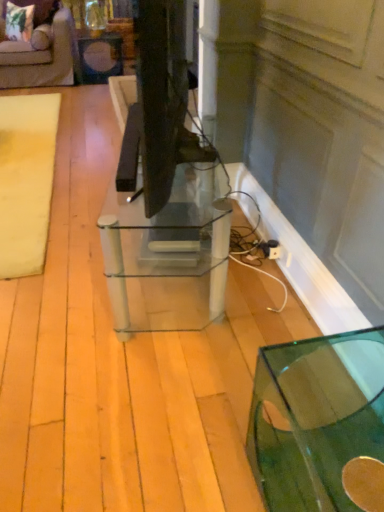
Question: Is beige fabric mat at left to the right of matte black side table at upper left from the viewer's perspective?

Choices:
 (A) yes
 (B) no

Answer: (B)

Question: Is beige fabric mat at left located outside matte black side table at upper left?

Choices:
 (A) no
 (B) yes

Answer: (B)

Question: Could you tell me if beige fabric mat at left is facing matte black side table at upper left?

Choices:
 (A) no
 (B) yes

Answer: (A)

Question: Is beige fabric mat at left bigger than matte black side table at upper left?

Choices:
 (A) yes
 (B) no

Answer: (B)

Question: Can you confirm if beige fabric mat at left is shorter than matte black side table at upper left?

Choices:
 (A) yes
 (B) no

Answer: (A)

Question: Is point (137, 180) positioned closer to the camera than point (279, 484)?

Choices:
 (A) closer
 (B) farther

Answer: (B)

Question: From a real-world perspective, relative to transparent glass table at lower right, arranged as the first table when viewed from the right, is clear glass table at center, marked as the second table in a right-to-left arrangement, vertically above or below?

Choices:
 (A) below
 (B) above

Answer: (B)

Question: In the image, is clear glass table at center, arranged as the second table when viewed from the front, positioned in front of or behind transparent glass table at lower right, the 2th table positioned from the top?

Choices:
 (A) front
 (B) behind

Answer: (B)

Question: Based on their positions, is clear glass table at center, the 1th table when ordered from back to front, located to the left or right of transparent glass table at lower right, the 2th table positioned from the top?

Choices:
 (A) right
 (B) left

Answer: (B)

Question: Is transparent glass table at lower right, arranged as the 1th table when ordered from the bottom, in front of or behind velvet beige sofa at upper left in the image?

Choices:
 (A) behind
 (B) front

Answer: (B)

Question: Considering the positions of transparent glass table at lower right, arranged as the first table when viewed from the right, and velvet beige sofa at upper left in the image, is transparent glass table at lower right, arranged as the first table when viewed from the right, taller or shorter than velvet beige sofa at upper left?

Choices:
 (A) tall
 (B) short

Answer: (B)

Question: In terms of width, does transparent glass table at lower right, the 2th table positioned from the top, look wider or thinner when compared to velvet beige sofa at upper left?

Choices:
 (A) thin
 (B) wide

Answer: (A)

Question: From a real-world perspective, is transparent glass table at lower right, arranged as the 1th table when ordered from the bottom, above or below velvet beige sofa at upper left?

Choices:
 (A) below
 (B) above

Answer: (A)

Question: Choose the correct answer: Is clear glass table at center, marked as the second table in a right-to-left arrangement, inside velvet beige sofa at upper left or outside it?

Choices:
 (A) inside
 (B) outside

Answer: (B)

Question: Considering the relative positions of clear glass table at center, arranged as the second table when viewed from the front, and velvet beige sofa at upper left in the image provided, is clear glass table at center, arranged as the second table when viewed from the front, to the left or to the right of velvet beige sofa at upper left?

Choices:
 (A) right
 (B) left

Answer: (A)